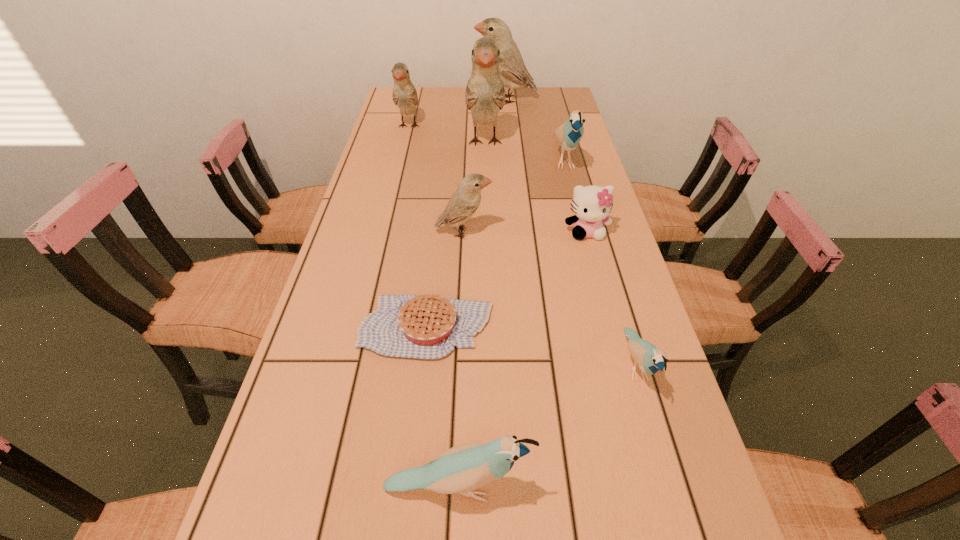
The height and width of the screenshot is (540, 960). I want to click on object that stands as the eighth closest to the biggest white bird, so click(461, 469).

Identify the location of the closest object relative to the second smallest white bird. (485, 94).

Identify which bird is the second closest to the farthest white bird. Please provide its 2D coordinates. Your answer should be formatted as a tuple, i.e. [(x, y)], where the tuple contains the x and y coordinates of a point satisfying the conditions above.

[(405, 96)]

Locate which bird is the second closest to the farthest white bird. Please provide its 2D coordinates. Your answer should be formatted as a tuple, i.e. [(x, y)], where the tuple contains the x and y coordinates of a point satisfying the conditions above.

[(405, 96)]

Locate an element on the screen. This screenshot has height=540, width=960. white bird that is the third closest one to the tallest object is located at coordinates (465, 201).

Where is `white bird that is the second closest to the leftmost white bird`? white bird that is the second closest to the leftmost white bird is located at coordinates (513, 72).

Locate which blue bird ranks in proximity to the shortest object. Please provide its 2D coordinates. Your answer should be formatted as a tuple, i.e. [(x, y)], where the tuple contains the x and y coordinates of a point satisfying the conditions above.

[(461, 469)]

What are the coordinates of `the closest blue bird to the farthest blue bird` in the screenshot? It's located at (650, 359).

Image resolution: width=960 pixels, height=540 pixels. What are the coordinates of `free spot that satisfies the following two spatial constraints: 1. at the face of the smallest blue bird; 2. at the face of the leftmost blue bird` in the screenshot? It's located at pyautogui.click(x=672, y=488).

Locate an element on the screen. vacant position in the image that satisfies the following two spatial constraints: 1. on the front-facing side of the kitten; 2. at the face of the smallest white bird is located at coordinates (587, 233).